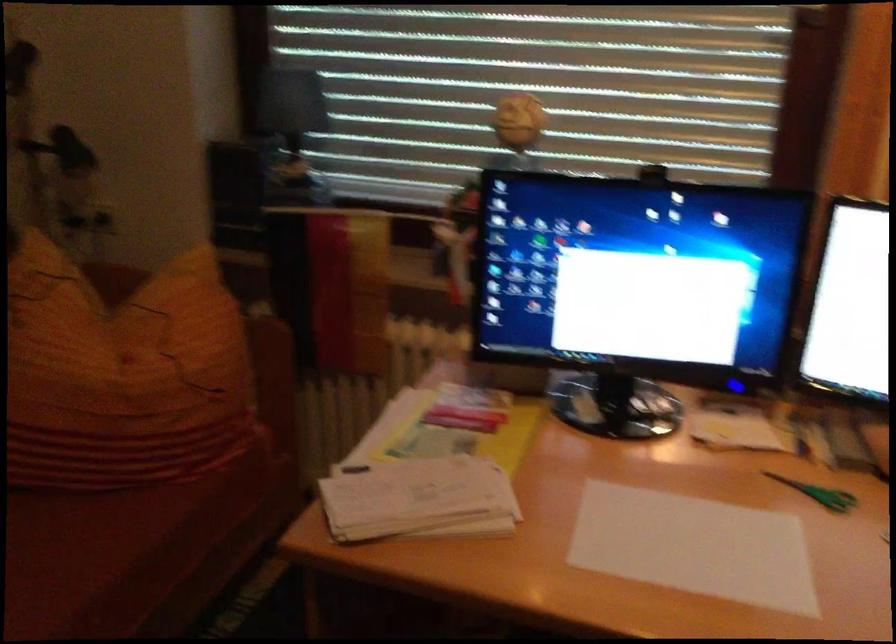
What are the coordinates of `chair sitting surface` in the screenshot? It's located at coord(66,556).